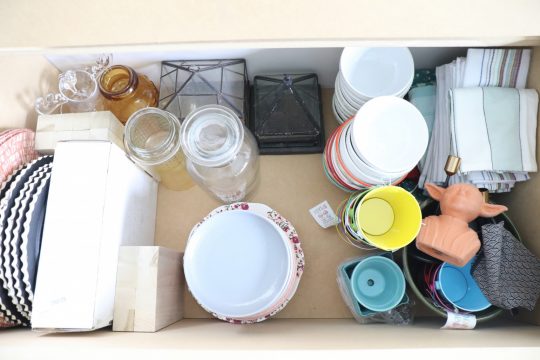
Identify the location of plate. Image resolution: width=540 pixels, height=360 pixels. (298, 269).